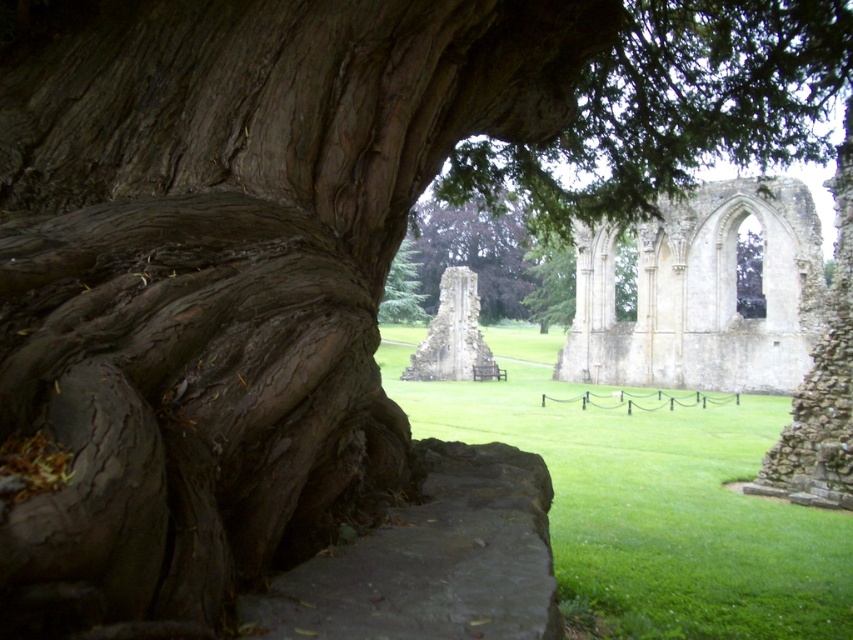
Question: Which of these objects is positioned farthest from the green textured tree at center?

Choices:
 (A) brown rough bark at left
 (B) green leafy tree at center
 (C) white stone ruins at center
 (D) stone ruins at center

Answer: (C)

Question: Which is farther from the stone ruins at center?

Choices:
 (A) green textured tree at center
 (B) brown rough bark at left
 (C) white stone ruins at center

Answer: (B)

Question: Is white stone ruins at center bigger than green textured tree at center?

Choices:
 (A) yes
 (B) no

Answer: (B)

Question: Does green leafy tree at center come behind stone ruins at center?

Choices:
 (A) yes
 (B) no

Answer: (B)

Question: Which object is closer to the camera taking this photo?

Choices:
 (A) stone ruins at center
 (B) green leafy tree at center

Answer: (B)

Question: Can you confirm if white stone ruins at center is positioned below stone ruins at center?

Choices:
 (A) no
 (B) yes

Answer: (A)